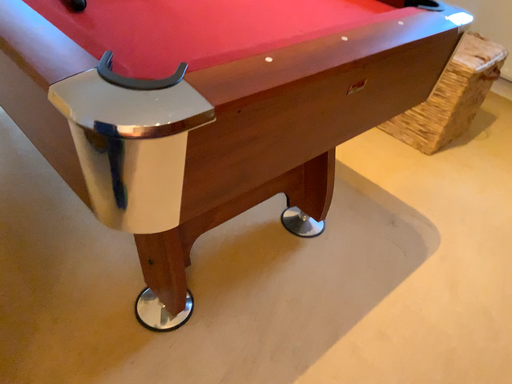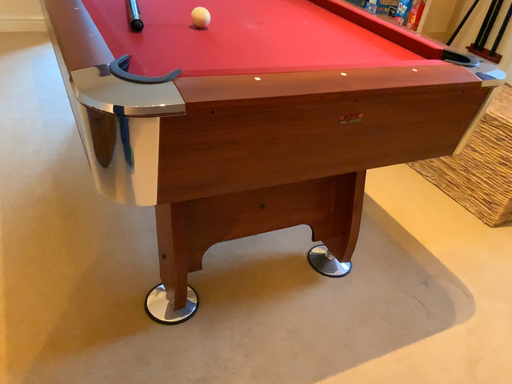
Question: How did the camera likely rotate when shooting the video?

Choices:
 (A) rotated downward
 (B) rotated upward

Answer: (B)